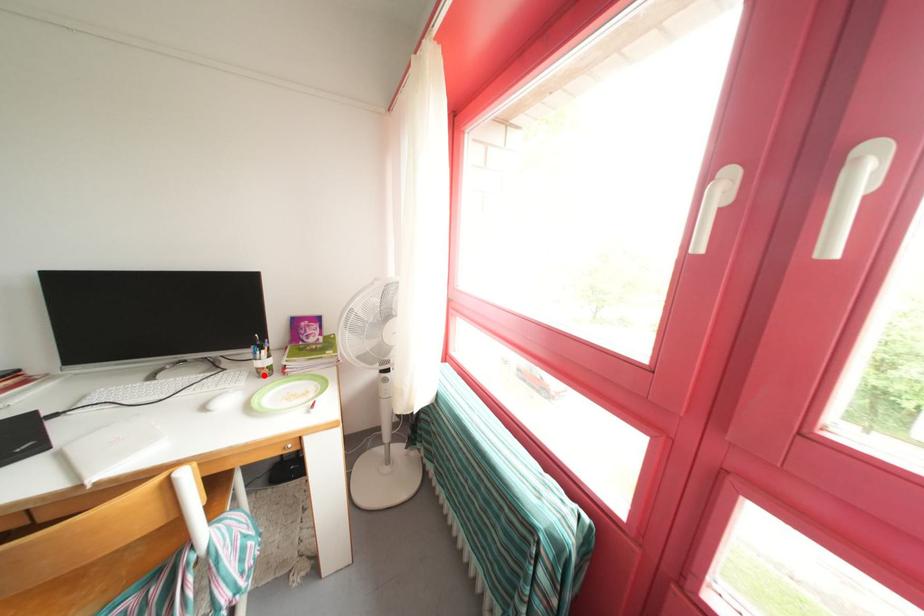
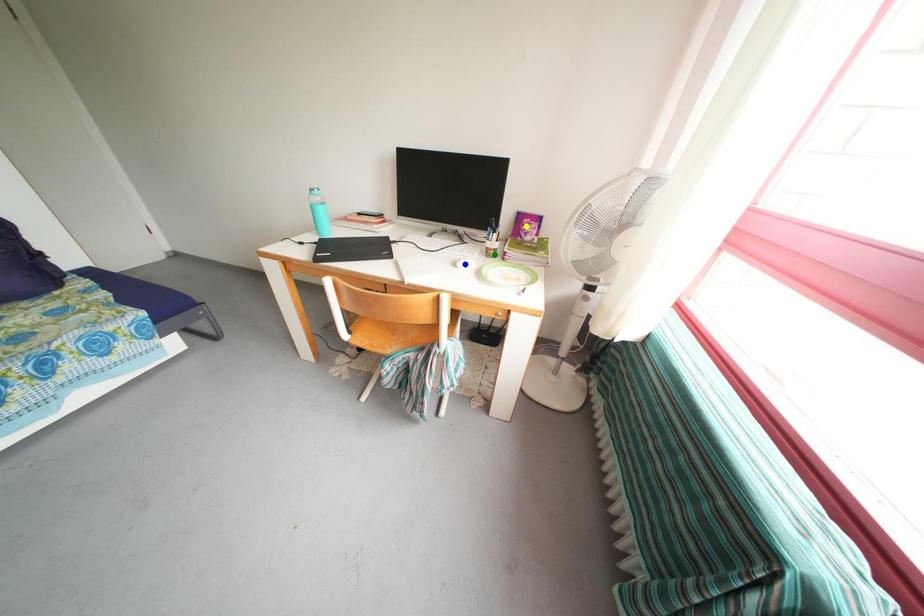
Question: I am providing you with two images of the same scene from different viewpoints. A red point is marked on the first image. You are given multiple points on the second image. Which mark in image 2 goes with the point in image 1?

Choices:
 (A) green point
 (B) yellow point
 (C) blue point

Answer: (A)